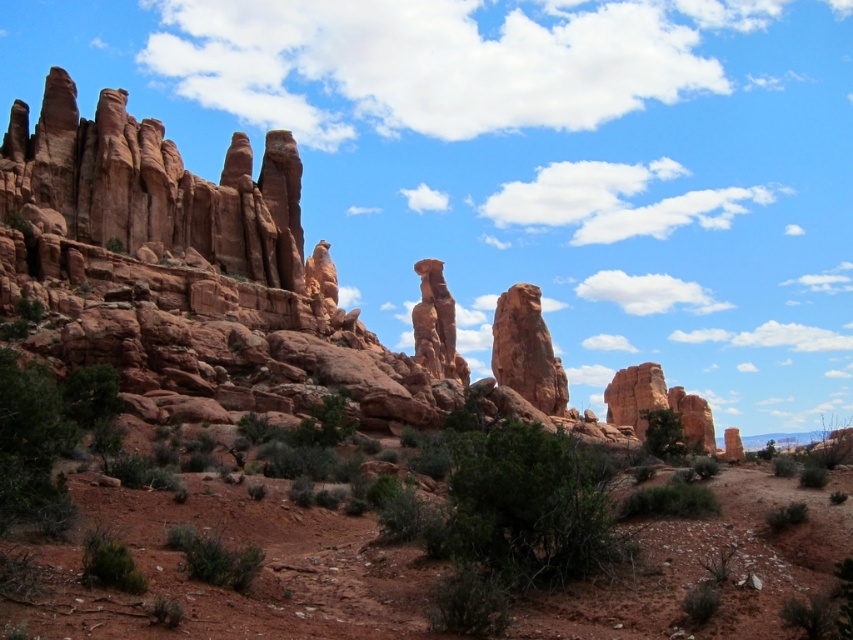
Is green leafy bush at lower center taller than green leafy bush at lower right?

In fact, green leafy bush at lower center may be shorter than green leafy bush at lower right.

Who is higher up, green leafy bush at lower center or green leafy bush at lower right?

green leafy bush at lower center is higher up.

You are a GUI agent. You are given a task and a screenshot of the screen. Output one action in this format:
    pyautogui.click(x=<x>, y=<y>)
    Task: Click on the green leafy bush at lower center
    This screenshot has height=640, width=853.
    Given the screenshot: What is the action you would take?
    pyautogui.click(x=670, y=500)

How much distance is there between green shrub at lower center and green leafy bush at lower right?

green shrub at lower center and green leafy bush at lower right are 45.99 meters apart from each other.

Between green shrub at lower center and green leafy bush at lower right, which one is positioned lower?

green leafy bush at lower right

Is point (212, 570) closer to camera compared to point (675, 435)?

That is True.

This screenshot has width=853, height=640. I want to click on green shrub at lower center, so click(215, 557).

Which is behind, point (521, 394) or point (204, 544)?

Point (521, 394)

Does rustic sandstone rock at center lie behind green shrub at lower center?

That is True.

Describe the element at coordinates (526, 349) in the screenshot. This screenshot has height=640, width=853. I see `rustic sandstone rock at center` at that location.

You are a GUI agent. You are given a task and a screenshot of the screen. Output one action in this format:
    pyautogui.click(x=<x>, y=<y>)
    Task: Click on the rustic sandstone rock at center
    The width and height of the screenshot is (853, 640).
    Given the screenshot: What is the action you would take?
    pyautogui.click(x=526, y=349)